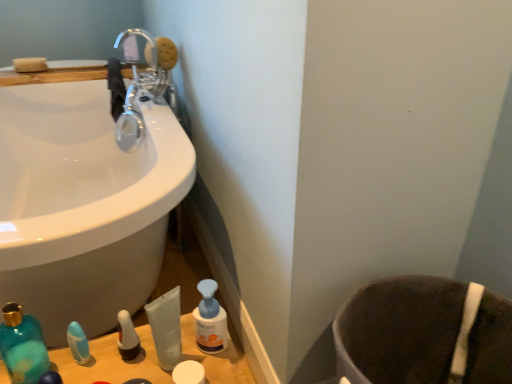
Question: Can chrome metallic faucet at upper left be found inside blue plastic pump bottle at lower center?

Choices:
 (A) no
 (B) yes

Answer: (A)

Question: Does blue plastic pump bottle at lower center have a lesser width compared to chrome metallic faucet at upper left?

Choices:
 (A) yes
 (B) no

Answer: (A)

Question: Would you say blue plastic pump bottle at lower center is outside chrome metallic faucet at upper left?

Choices:
 (A) yes
 (B) no

Answer: (A)

Question: From a real-world perspective, is blue plastic pump bottle at lower center over chrome metallic faucet at upper left?

Choices:
 (A) no
 (B) yes

Answer: (A)

Question: Can you confirm if blue plastic pump bottle at lower center is positioned to the left of chrome metallic faucet at upper left?

Choices:
 (A) yes
 (B) no

Answer: (B)

Question: Is point (206, 339) closer or farther from the camera than point (220, 380)?

Choices:
 (A) closer
 (B) farther

Answer: (B)

Question: Relative to matte plastic bottles at lower left, is blue plastic pump bottle at lower center in front or behind?

Choices:
 (A) behind
 (B) front

Answer: (A)

Question: Is blue plastic pump bottle at lower center inside the boundaries of matte plastic bottles at lower left, or outside?

Choices:
 (A) outside
 (B) inside

Answer: (A)

Question: From a real-world perspective, is blue plastic pump bottle at lower center physically located above or below matte plastic bottles at lower left?

Choices:
 (A) below
 (B) above

Answer: (B)

Question: Do you think white matte container at lower center, the 1th toiletry in the right-to-left sequence, is within teal glass mouthwash at lower left, or outside of it?

Choices:
 (A) outside
 (B) inside

Answer: (A)

Question: Considering the positions of point (179, 382) and point (30, 380), is point (179, 382) closer or farther from the camera than point (30, 380)?

Choices:
 (A) closer
 (B) farther

Answer: (B)

Question: In terms of height, does white matte container at lower center, the 1th toiletry in the right-to-left sequence, look taller or shorter compared to teal glass mouthwash at lower left?

Choices:
 (A) short
 (B) tall

Answer: (A)

Question: In terms of width, does white matte container at lower center, the 4th toiletry when ordered from left to right, look wider or thinner when compared to teal glass mouthwash at lower left?

Choices:
 (A) thin
 (B) wide

Answer: (A)

Question: From a real-world perspective, relative to brown fabric toilet bowl at lower right, is translucent plastic pump bottle at lower left, positioned as the second toiletry in left-to-right order, vertically above or below?

Choices:
 (A) below
 (B) above

Answer: (B)

Question: Is translucent plastic pump bottle at lower left, the third toiletry positioned from the right, wider or thinner than brown fabric toilet bowl at lower right?

Choices:
 (A) wide
 (B) thin

Answer: (B)